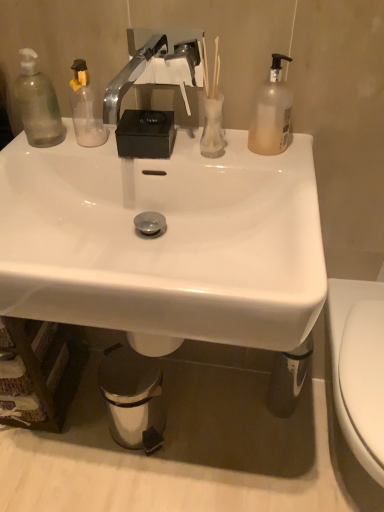
Question: In terms of size, does shiny metallic trash can at lower center appear bigger or smaller than white glossy toilet at right?

Choices:
 (A) small
 (B) big

Answer: (A)

Question: Is shiny metallic trash can at lower center in front of or behind white glossy toilet at right in the image?

Choices:
 (A) front
 (B) behind

Answer: (B)

Question: Estimate the real-world distances between objects in this image. Which object is closer to the transparent plastic bottle at left, which is the first bottle from left to right?

Choices:
 (A) white glossy sink at center
 (B) translucent plastic bottle at upper right, placed as the 2th bottle when sorted from left to right
 (C) chrome metallic faucet at upper center
 (D) transparent glass vase at upper center
 (E) shiny metallic trash can at lower center

Answer: (C)

Question: Estimate the real-world distances between objects in this image. Which object is closer to the white glossy sink at center?

Choices:
 (A) shiny metallic trash can at lower center
 (B) chrome metallic faucet at upper center
 (C) translucent plastic bottle at upper right, placed as the 2th bottle when sorted from left to right
 (D) transparent glass vase at upper center
 (E) white glossy toilet at right

Answer: (D)